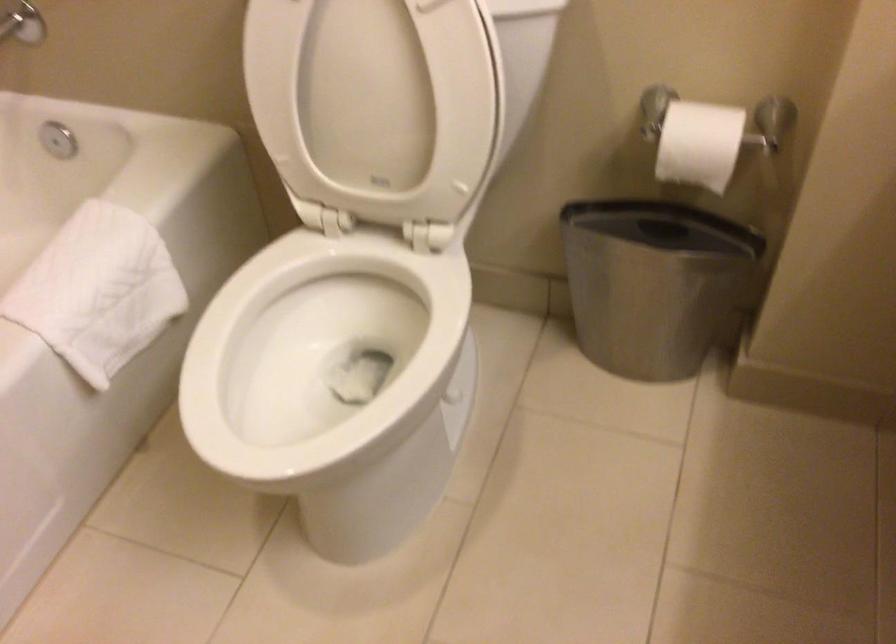
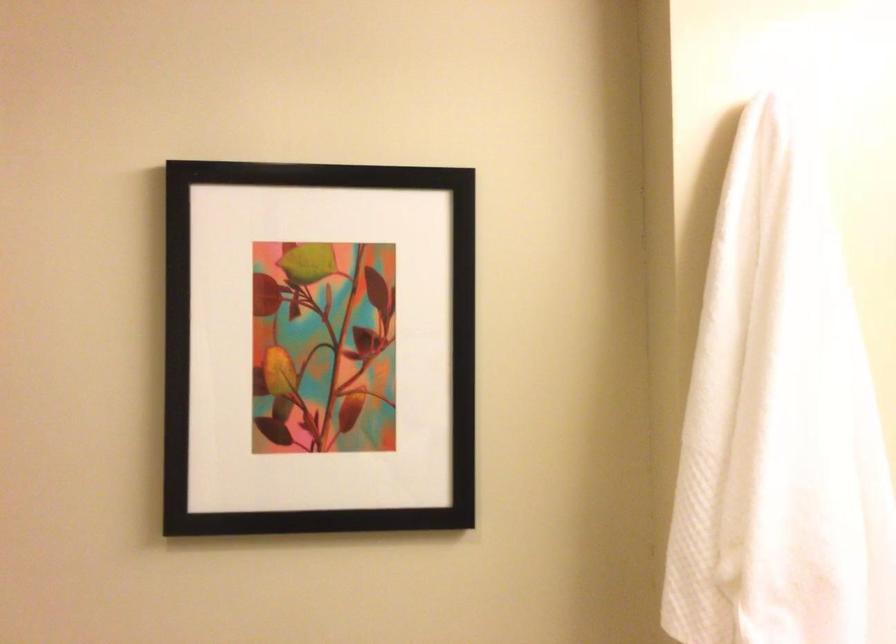
How did the camera likely rotate?

The camera's rotation is toward right-up.